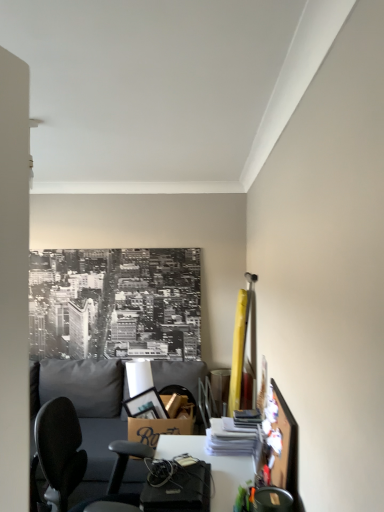
Question: Would you say brown cardboard box at center is inside or outside white glossy desk at center?

Choices:
 (A) inside
 (B) outside

Answer: (B)

Question: Does point (190, 406) appear closer or farther from the camera than point (210, 456)?

Choices:
 (A) farther
 (B) closer

Answer: (A)

Question: Which object is the farthest from the white glossy desk at center?

Choices:
 (A) metallic gray chair at lower right
 (B) gray fabric couch at lower left
 (C) brown cardboard box at center

Answer: (B)

Question: Estimate the real-world distances between objects in this image. Which object is farther from the metallic gray chair at lower right?

Choices:
 (A) brown cardboard box at center
 (B) gray fabric couch at lower left
 (C) white glossy desk at center

Answer: (B)